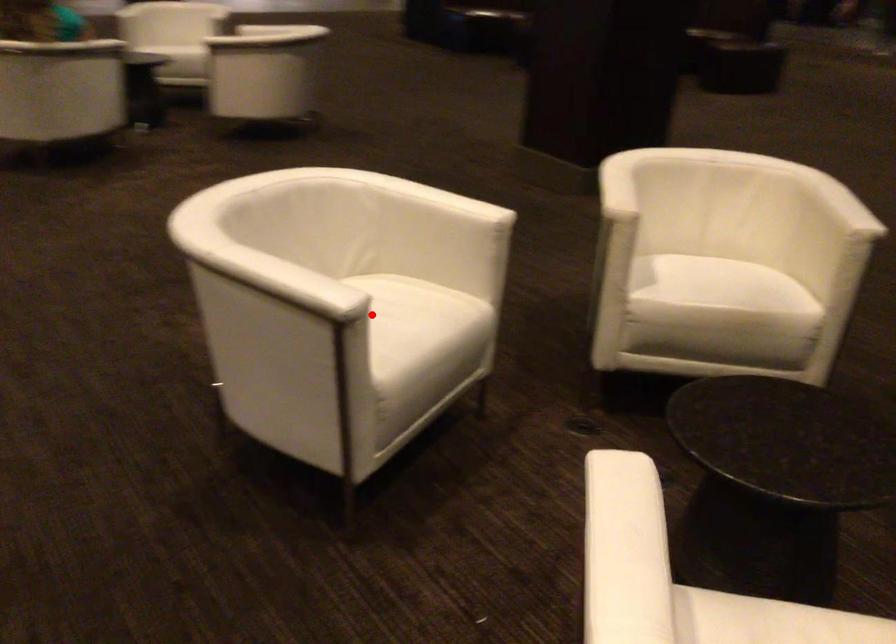
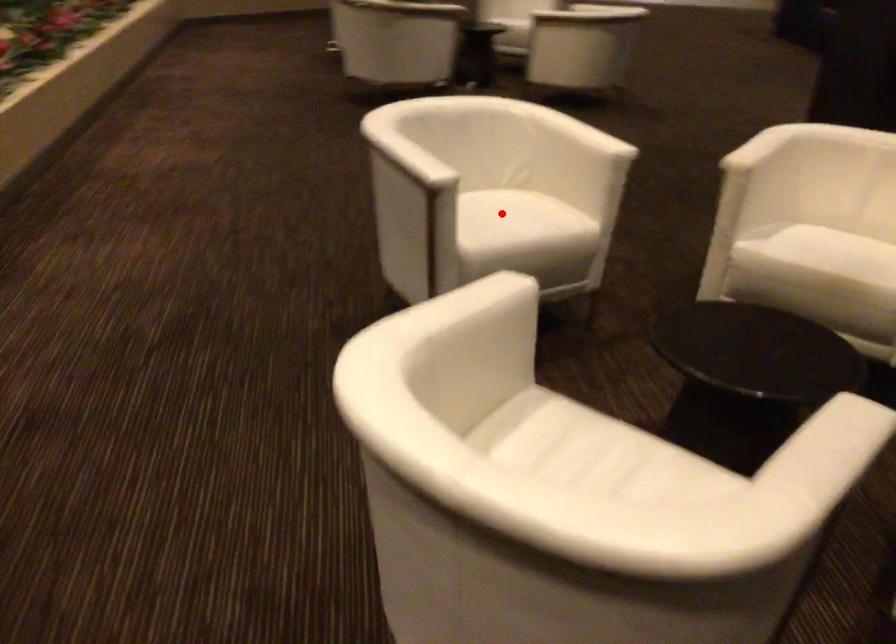
I am providing you with two images of the same scene from different viewpoints. A red point is marked on the first image and another point is marked on the second image. Is the marked point in image1 the same physical position as the marked point in image2?

Yes